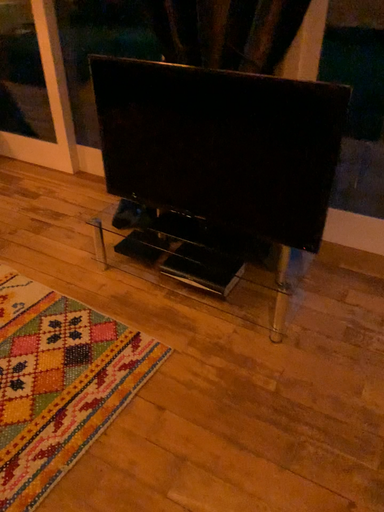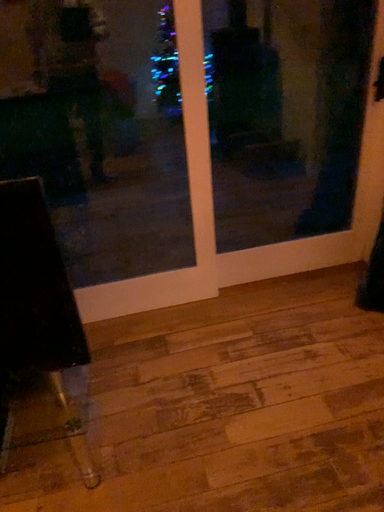
Question: How did the camera likely rotate when shooting the video?

Choices:
 (A) rotated downward
 (B) rotated upward

Answer: (B)